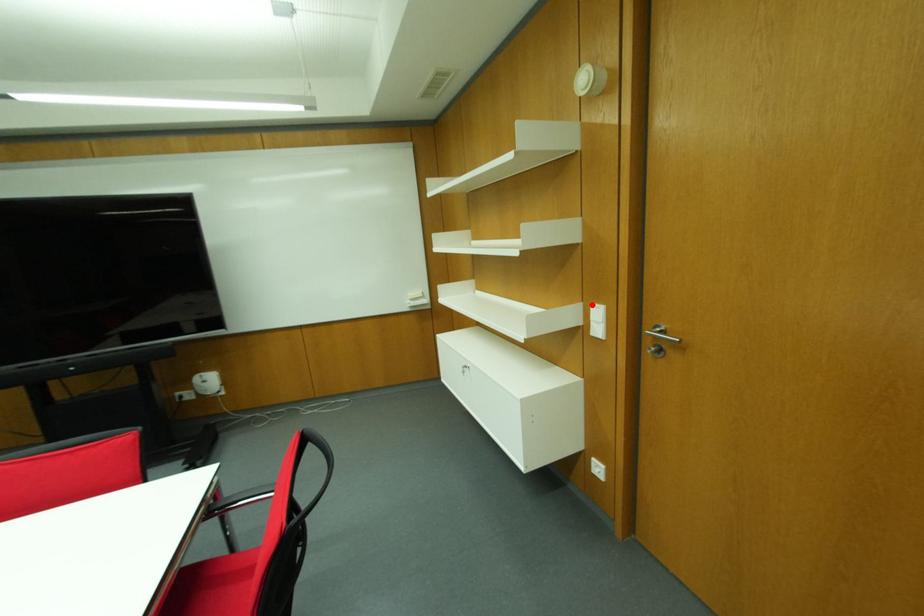
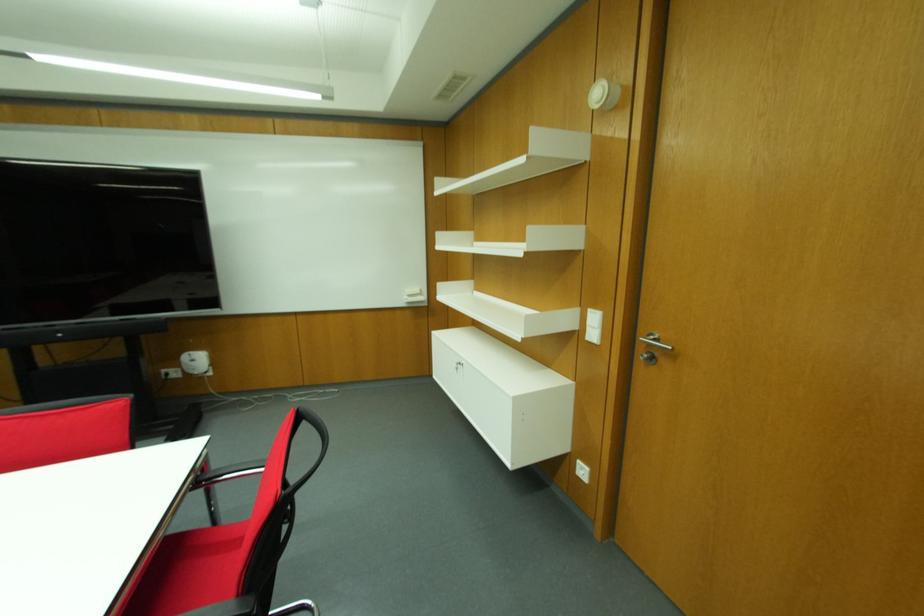
Where in the second image is the point corresponding to the highlighted location from the first image?

(589, 310)